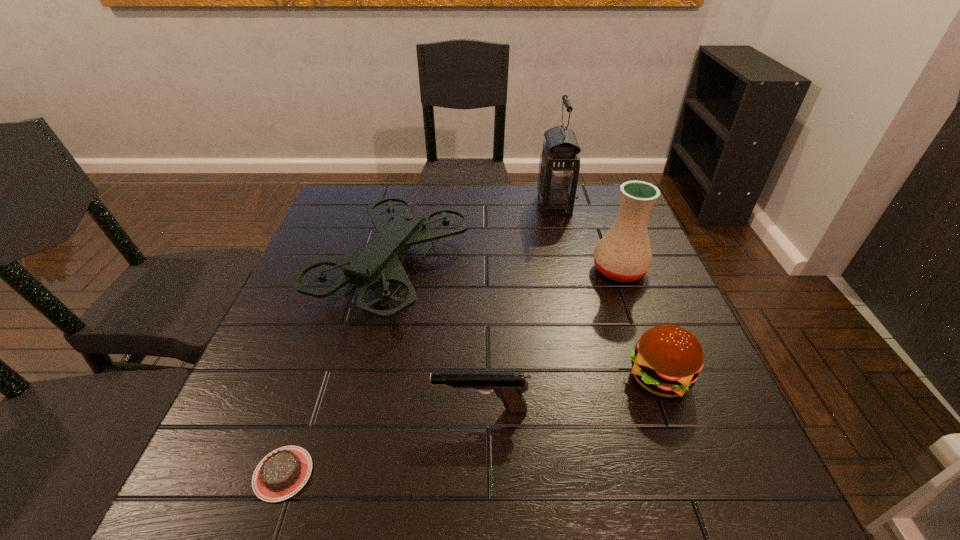
Image resolution: width=960 pixels, height=540 pixels. I want to click on free region located 0.320m on the front-facing side of the lantern, so click(432, 205).

At what (x,y) coordinates should I click in order to perform the action: click on vacant point located 0.330m on the back of the pottery. Please return your answer as a coordinate pair (x, y). Looking at the image, I should click on (589, 190).

You are a GUI agent. You are given a task and a screenshot of the screen. Output one action in this format:
    pyautogui.click(x=<x>, y=<y>)
    Task: Click on the free space located on the front of the drone
    The image size is (960, 540).
    Given the screenshot: What is the action you would take?
    pyautogui.click(x=348, y=455)

Image resolution: width=960 pixels, height=540 pixels. What are the coordinates of `free space located on the left of the hamburger` in the screenshot? It's located at (448, 377).

Image resolution: width=960 pixels, height=540 pixels. I want to click on vacant space located at the muzzle of the pistol, so pyautogui.click(x=401, y=410).

Identify the location of free spot located 0.340m at the muzzle of the pistol. This screenshot has height=540, width=960. (250, 410).

Find the location of a particular element. The image size is (960, 540). vacant position located 0.300m at the muzzle of the pistol is located at coordinates (272, 410).

At what (x,y) coordinates should I click in order to perform the action: click on vacant region located 0.390m on the back of the nearest object. Please return your answer as a coordinate pair (x, y). Looking at the image, I should click on (345, 293).

The image size is (960, 540). I want to click on lantern positioned at the far edge, so click(x=559, y=165).

Locate an element on the screen. This screenshot has width=960, height=540. drone that is at the far edge is located at coordinates (379, 262).